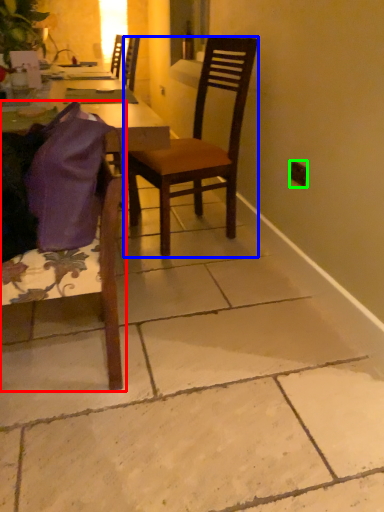
Question: Considering the real-world distances, which object is closest to chair (highlighted by a red box)? chair (highlighted by a blue box) or power outlet (highlighted by a green box).

Choices:
 (A) chair
 (B) power outlet

Answer: (A)